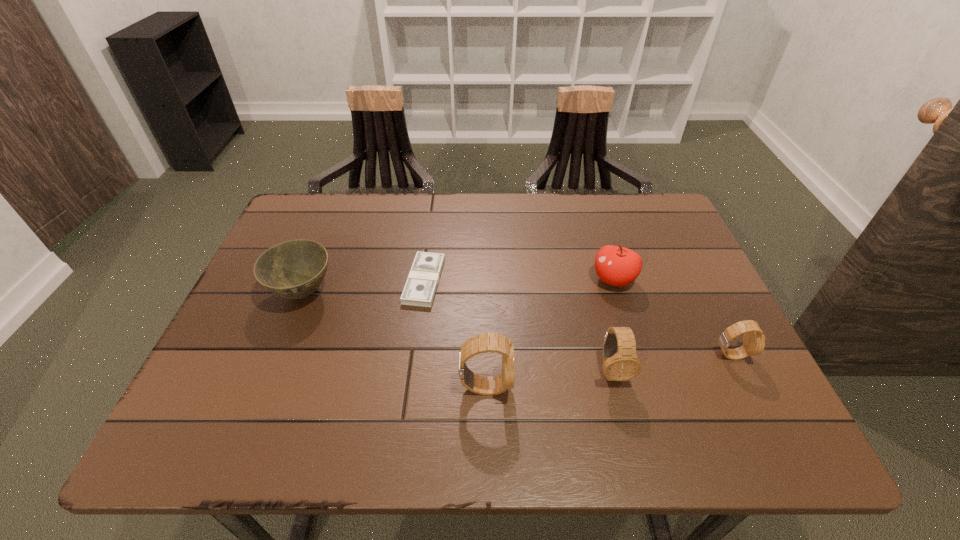
Locate an element on the screen. The width and height of the screenshot is (960, 540). free point that keeps the watchs evenly spaced on the left is located at coordinates (350, 404).